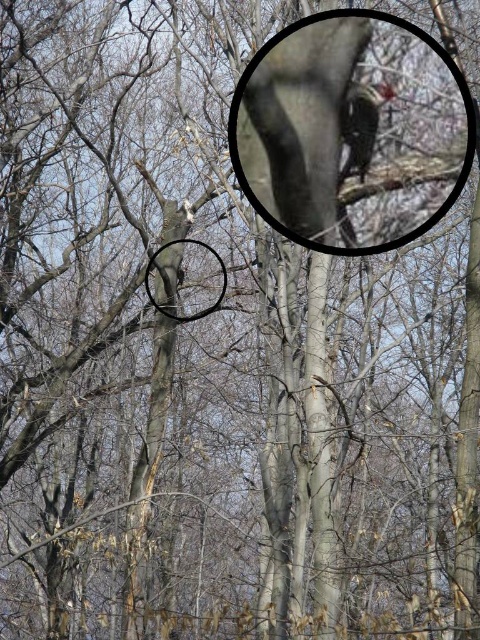
Between smooth brown woodpecker at upper center and smooth gray basketball hoop at center, which one is positioned lower?

smooth gray basketball hoop at center is below.

Does smooth brown woodpecker at upper center have a greater width compared to smooth gray basketball hoop at center?

No, smooth brown woodpecker at upper center is not wider than smooth gray basketball hoop at center.

Is point (358, 104) positioned behind point (179, 321)?

No.

Locate an element on the screen. This screenshot has width=480, height=640. smooth brown woodpecker at upper center is located at coordinates (360, 125).